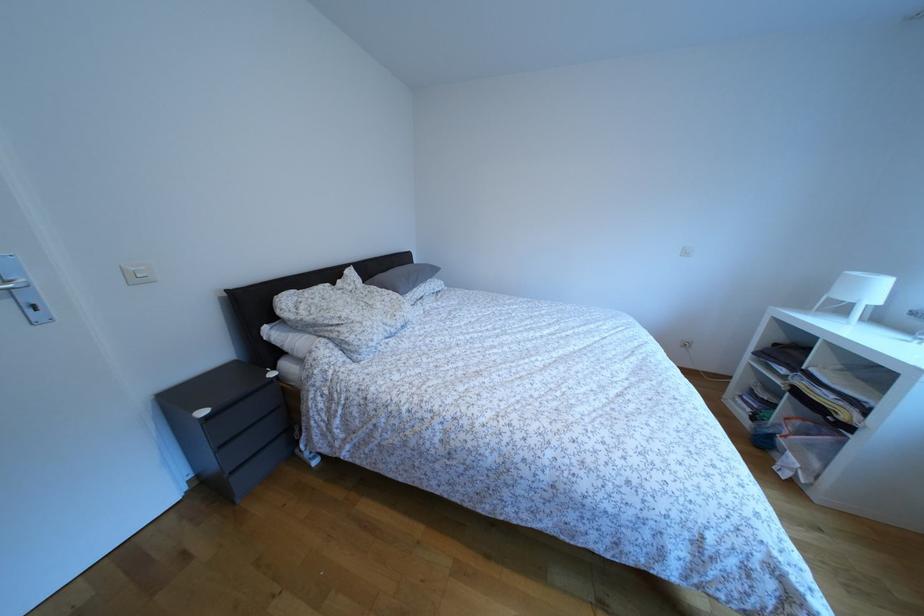
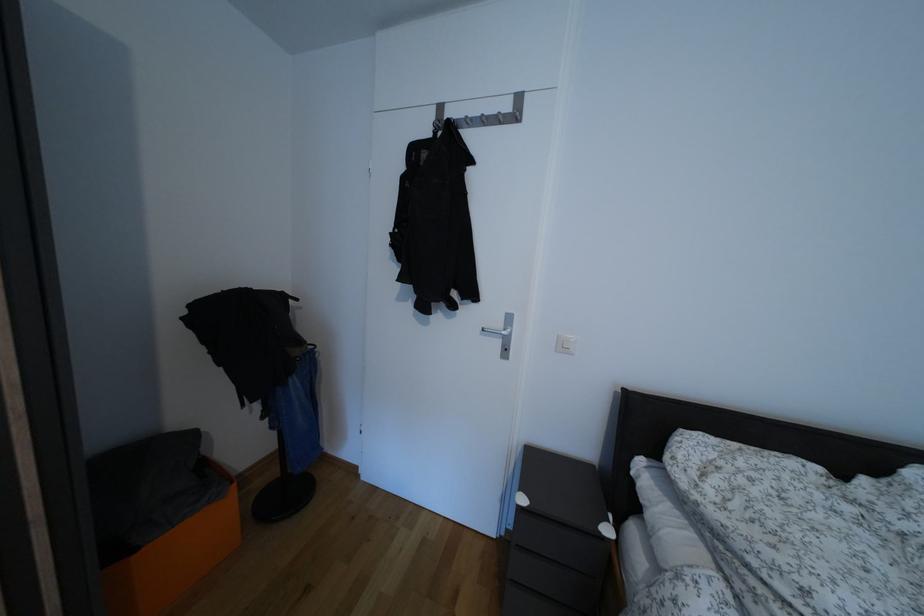
Question: The images are taken continuously from a first-person perspective. In which direction is your viewpoint rotating?

Choices:
 (A) Left
 (B) Right
 (C) Up
 (D) Down

Answer: (A)